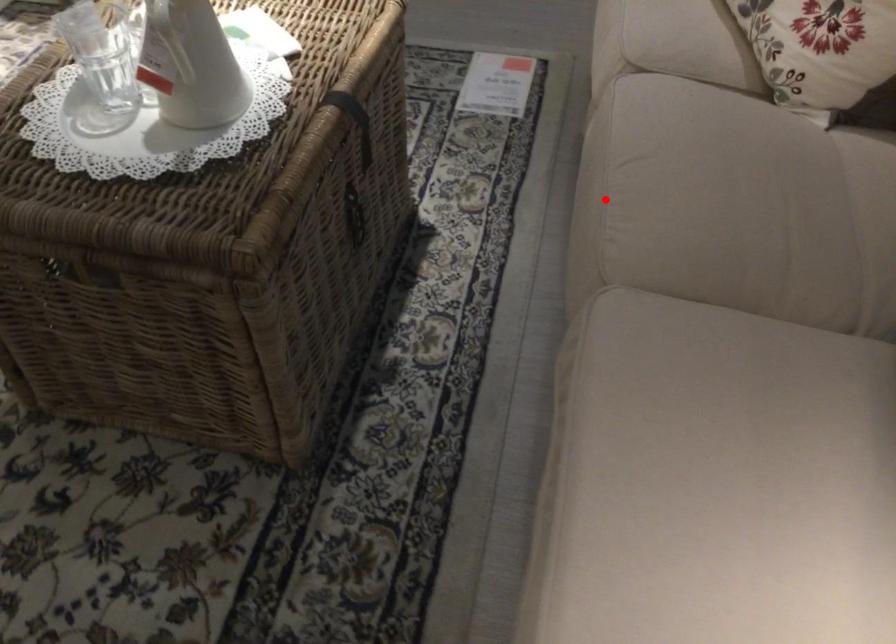
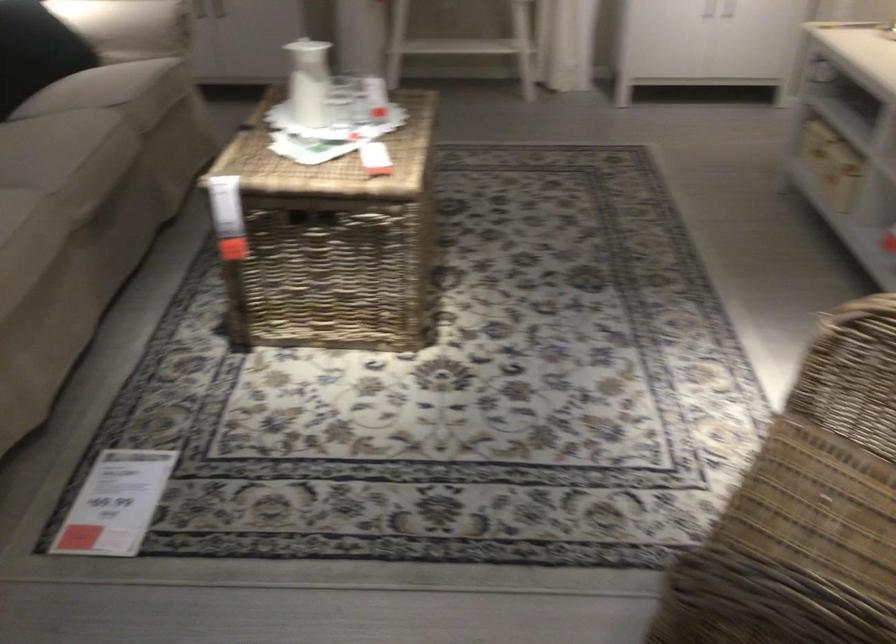
Question: A red point is marked in image1. In image2, is the corresponding 3D point closer to the camera or farther? Reply with the corresponding letter.

Choices:
 (A) The corresponding 3D point is closer.
 (B) The corresponding 3D point is farther.

Answer: (B)